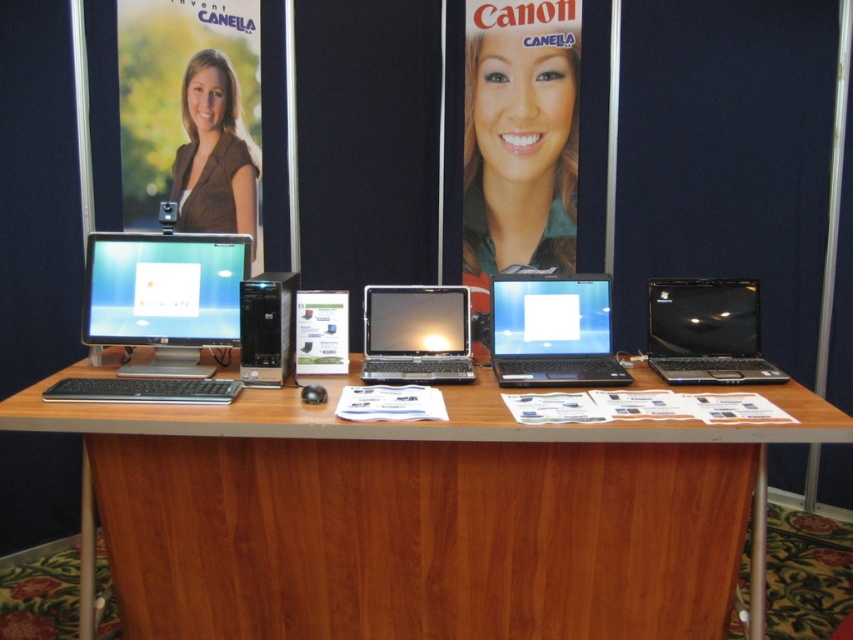
Question: Considering the real-world distances, which object is closest to the matte black monitor at center?

Choices:
 (A) glossy black laptop at right
 (B) matte black laptop at center
 (C) brown fabric poster at upper left
 (D) brown wood computer desk at center

Answer: (D)

Question: From the image, what is the correct spatial relationship of brown wood computer desk at center in relation to matte black monitor at center?

Choices:
 (A) right
 (B) left

Answer: (A)

Question: Which object appears farthest from the camera in this image?

Choices:
 (A) glossy black laptop at right
 (B) satin black laptop at center
 (C) white glossy poster at center
 (D) brown fabric poster at upper left

Answer: (D)

Question: Does brown fabric poster at upper left have a greater width compared to matte black monitor at center?

Choices:
 (A) no
 (B) yes

Answer: (A)

Question: Based on their relative distances, which object is nearer to the white glossy poster at center?

Choices:
 (A) black plastic desktop at center
 (B) matte black monitor at center
 (C) matte black laptop at center

Answer: (A)

Question: Can you confirm if brown fabric poster at upper left is positioned above matte black monitor at center?

Choices:
 (A) yes
 (B) no

Answer: (A)